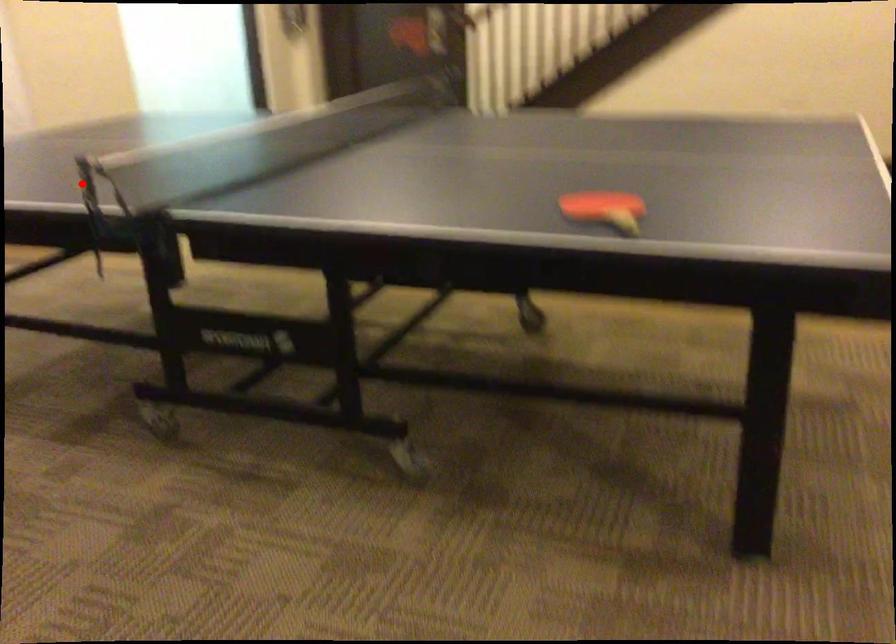
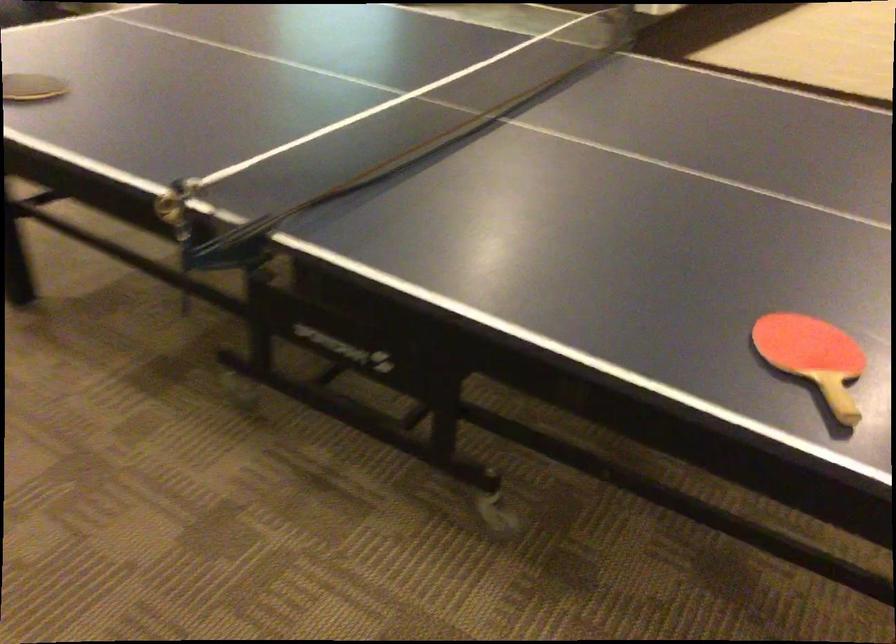
Question: I am providing you with two images of the same scene from different viewpoints. Given a red point in image1, look at the same physical point in image2. Is it:

Choices:
 (A) Closer to the viewpoint
 (B) Farther from the viewpoint

Answer: (A)